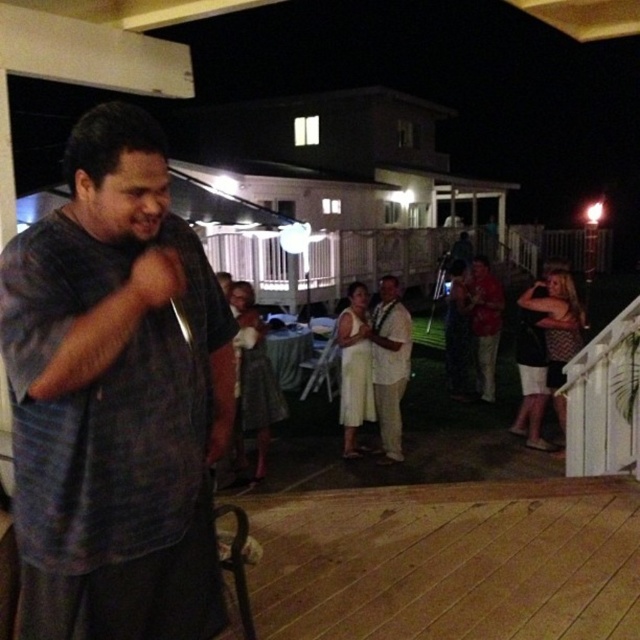
You are a photographer at the event and want to capture both the dark blue shirt at center and the white lace dress at center in the same frame. Which one should you focus on first to ensure both are in focus?

The dark blue shirt at center is in front of the white lace dress at center, so you should focus on the dark blue shirt at center first to ensure both are in focus.